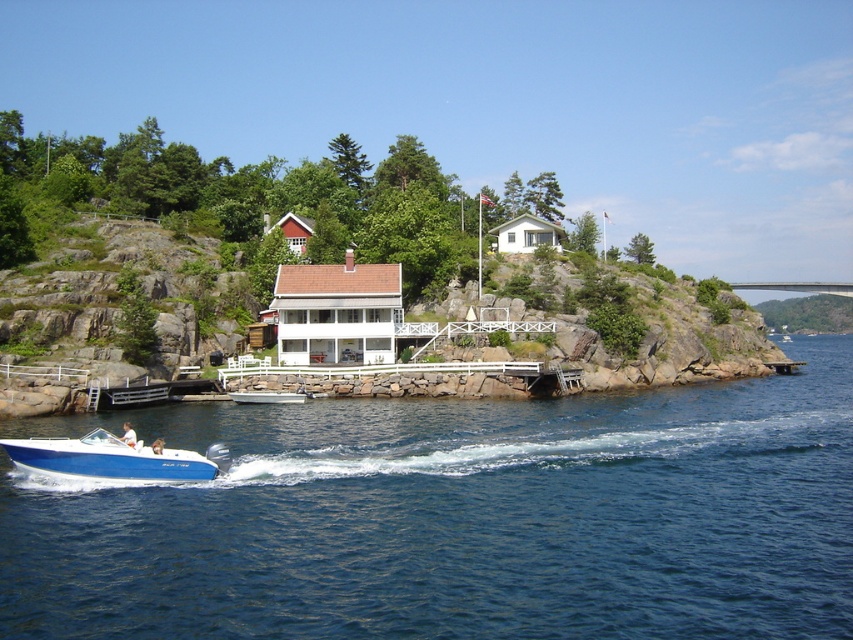
You are a sailor on a boat that requires at least 15 meters of open water to safely maneuver. You observe the blue glossy boat at lower left and the blue liquid water at lower center in the scene. Is there enough space between them for your boat to safely maneuver?

The distance between the blue liquid water at lower center and the blue glossy boat at lower left is 14.23 meters. Since your boat needs at least 15 meters of open water to maneuver safely, there is insufficient space between them for safe maneuvering.

You are planning to take a photo of the blue glossy boat at lower left and the blue liquid water at lower center. Since you want to capture both in the frame, which object should you focus on to ensure both are visible?

You should focus on the blue glossy boat at lower left because the blue liquid water at lower center is wider, so centering the boat allows the water to spread out in the frame.